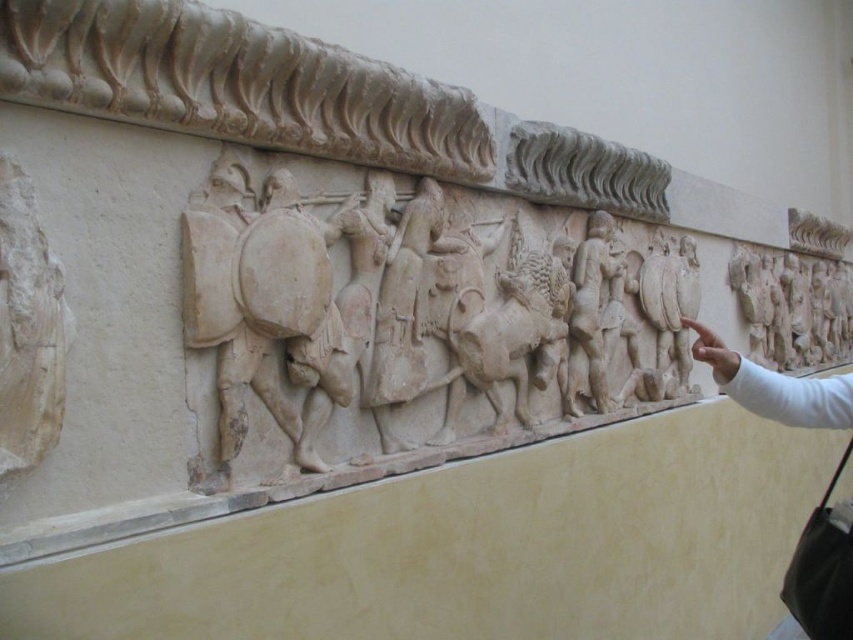
You are an archaeologist examining the ancient relief sculpture. You notice two points on the sculpture labeled as point 1 at coordinates [820,346] and point 2 at coordinates [602,273]. Which point is closer to the camera?

Point 1 at coordinates [820,346] is further to the camera than point 2 at coordinates [602,273], so point 2 is closer to the camera.

You are an archaeologist examining the ancient relief sculpture. You notice the white stone relief at center and the white stone warrior at center. Which one has a greater width?

The white stone relief at center has a greater width than the white stone warrior at center.